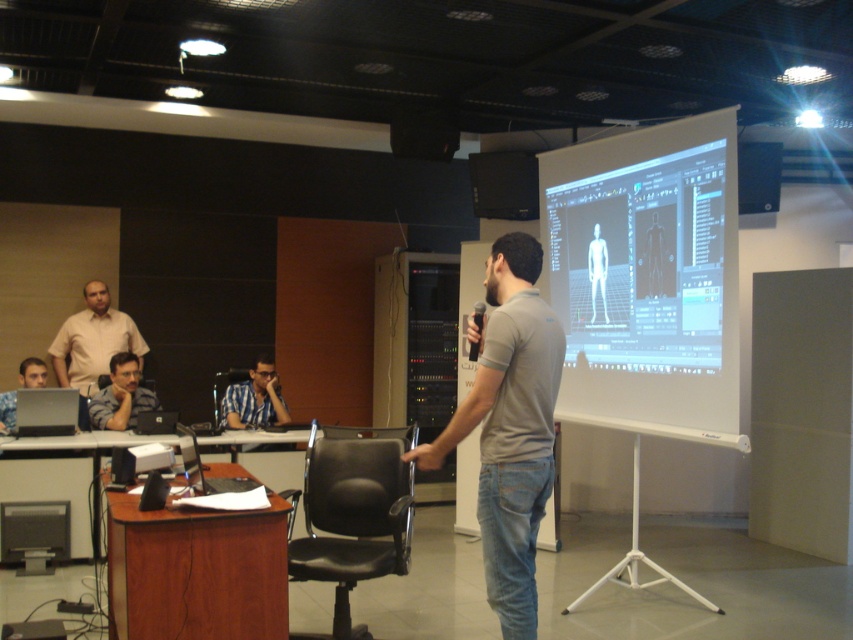
Question: Can you confirm if gray cotton t-shirt at center is positioned above translucent white human figure at center?

Choices:
 (A) yes
 (B) no

Answer: (B)

Question: Estimate the real-world distances between objects in this image. Which object is farther from the matte black laptop at left?

Choices:
 (A) gray fabric shirt at lower left
 (B) matte beige shirt at upper left

Answer: (B)

Question: Which point is farther to the camera?

Choices:
 (A) (276, 388)
 (B) (131, 387)

Answer: (A)

Question: Is gray cotton t-shirt at center to the right of blue checkered shirt at center from the viewer's perspective?

Choices:
 (A) no
 (B) yes

Answer: (B)

Question: Estimate the real-world distances between objects in this image. Which object is closer to the translucent white human figure at center?

Choices:
 (A) white matte projection screen at center
 (B) blue checkered shirt at center

Answer: (A)

Question: Does gray fabric shirt at lower left have a smaller size compared to translucent white human figure at center?

Choices:
 (A) no
 (B) yes

Answer: (A)